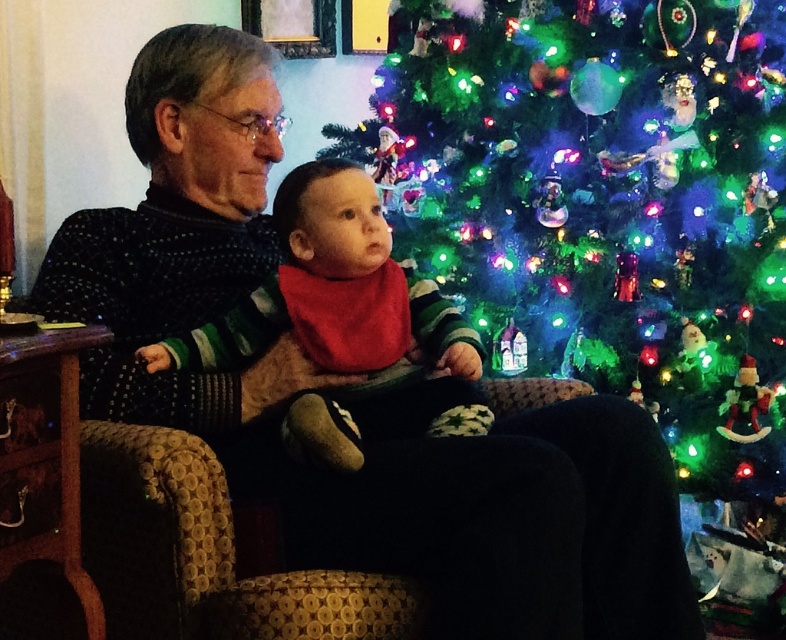
You are a parent preparing to take a photo of your child and the Christmas tree. You notice the iridescent plastic ornaments at center and the red cotton bib at center. Which object is closer to the camera?

The iridescent plastic ornaments at center is positioned over the red cotton bib at center, so it is closer to the camera.

You are a parent trying to decide where to place a new ornament. You see the iridescent plastic ornaments at center and the red cotton bib at center. Which object is bigger and should you consider placing the new ornament near the larger one?

The iridescent plastic ornaments at center are larger than the red cotton bib at center, so you should consider placing the new ornament near the iridescent plastic ornaments at center.